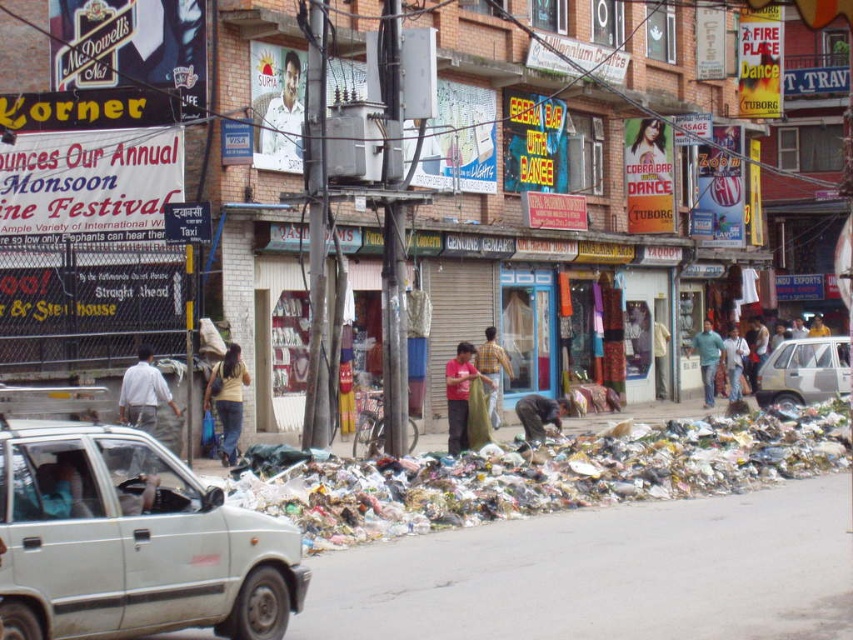
Question: Which object appears closest to the camera in this image?

Choices:
 (A) light gray fabric pants at center
 (B) silver metallic car at right
 (C) red cotton shirt at center
 (D) light brown fabric shirt at center

Answer: (A)

Question: From the image, what is the correct spatial relationship of white matte suv at lower left in relation to yellow striped shirt at center?

Choices:
 (A) right
 (B) left

Answer: (B)

Question: Does multicolored plastic bags at lower center come in front of yellow striped shirt at center?

Choices:
 (A) yes
 (B) no

Answer: (A)

Question: Does multicolored plastic bags at lower center lie behind light brown fabric bag at right?

Choices:
 (A) yes
 (B) no

Answer: (B)

Question: Estimate the real-world distances between objects in this image. Which object is closer to the smooth skin man at upper center?

Choices:
 (A) dark gray fabric at lower center
 (B) denim pants at center

Answer: (B)

Question: Which object is positioned farthest from the silver metallic car at right?

Choices:
 (A) yellow striped shirt at center
 (B) white matte suv at lower left
 (C) smooth skin man at upper center

Answer: (B)